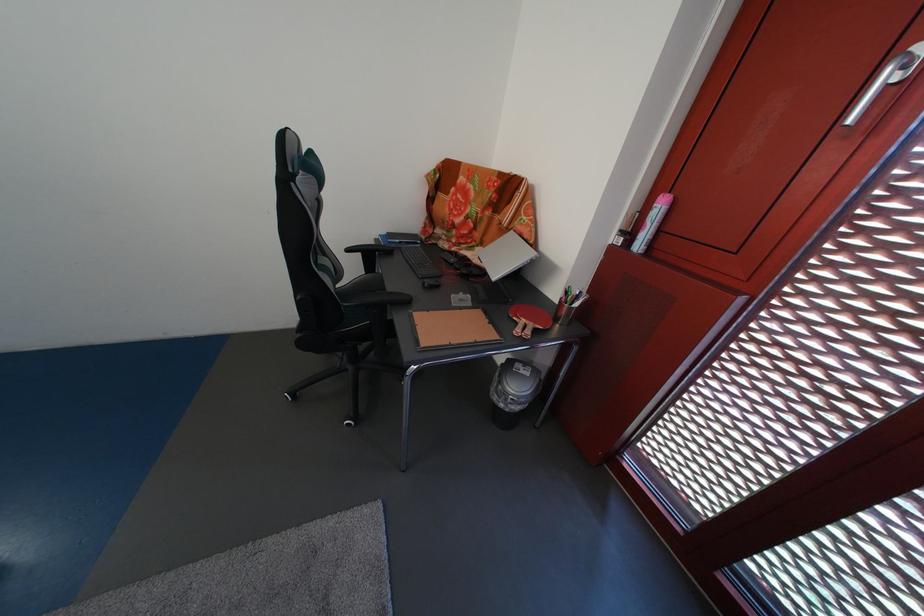
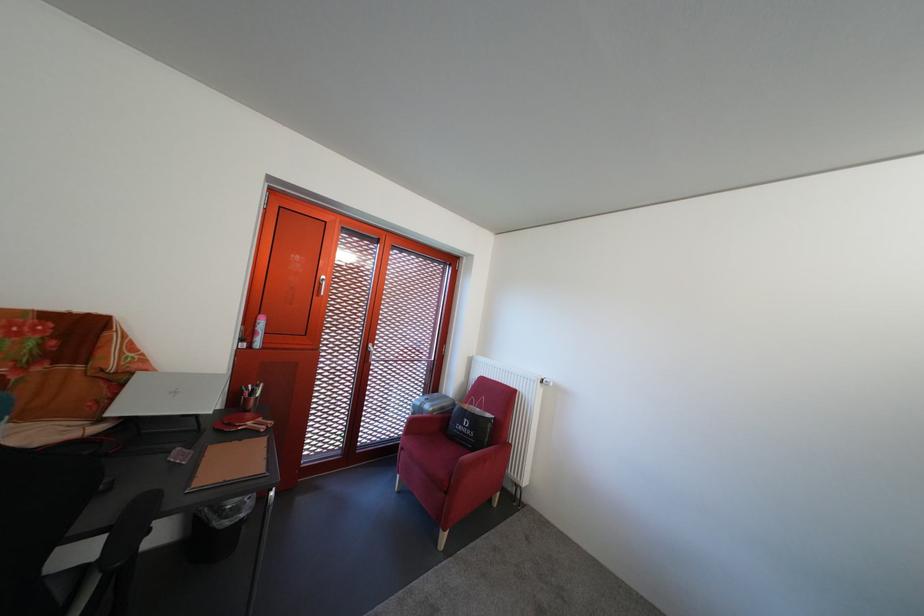
In the second image, find the point that corresponds to point 633,238 in the first image.

(252, 346)